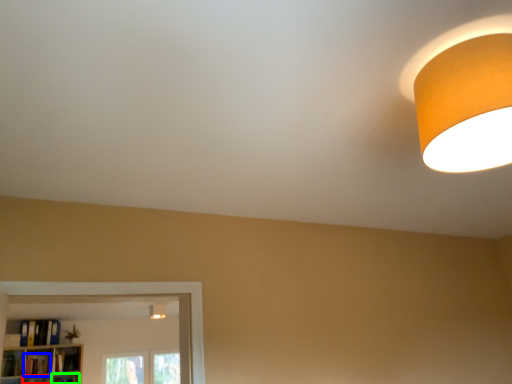
Question: Which object is the closest to the shelf (highlighted by a red box)? Choose among these: book (highlighted by a blue box) or shelf (highlighted by a green box).

Choices:
 (A) book
 (B) shelf

Answer: (A)